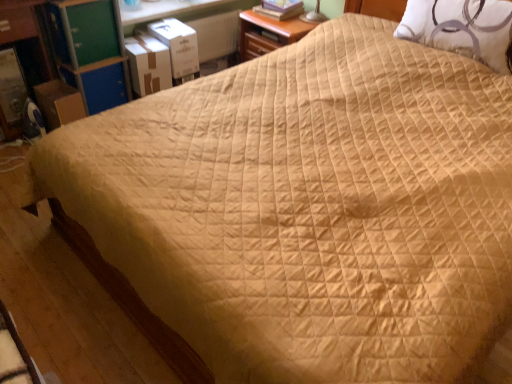
Question: Considering the relative positions of white cardboard box at upper left, which ranks as the second cardboard box in left-to-right order, and hardcover book at upper center in the image provided, is white cardboard box at upper left, which ranks as the second cardboard box in left-to-right order, to the left of hardcover book at upper center from the viewer's perspective?

Choices:
 (A) no
 (B) yes

Answer: (B)

Question: Can you confirm if white cardboard box at upper left, which ranks as the second cardboard box in left-to-right order, is bigger than hardcover book at upper center?

Choices:
 (A) yes
 (B) no

Answer: (A)

Question: Does white cardboard box at upper left, acting as the 2th cardboard box starting from the right, turn towards hardcover book at upper center?

Choices:
 (A) no
 (B) yes

Answer: (A)

Question: Can you confirm if white cardboard box at upper left, which ranks as the second cardboard box in left-to-right order, is shorter than hardcover book at upper center?

Choices:
 (A) yes
 (B) no

Answer: (B)

Question: Is hardcover book at upper center inside white cardboard box at upper left, acting as the 2th cardboard box starting from the right?

Choices:
 (A) yes
 (B) no

Answer: (B)

Question: Would you say green plastic dresser at upper left, placed as the second dresser when sorted from left to right, is to the left or to the right of brown cardboard box at left, the third cardboard box when ordered from right to left, in the picture?

Choices:
 (A) left
 (B) right

Answer: (B)

Question: Is point coord(7,39) positioned closer to the camera than point coord(50,112)?

Choices:
 (A) closer
 (B) farther

Answer: (A)

Question: From a real-world perspective, is green plastic dresser at upper left, placed as the second dresser when sorted from left to right, above or below brown cardboard box at left, marked as the 1th cardboard box in a left-to-right arrangement?

Choices:
 (A) above
 (B) below

Answer: (A)

Question: Is green plastic dresser at upper left, which is the first dresser in right-to-left order, bigger or smaller than brown cardboard box at left, the third cardboard box when ordered from right to left?

Choices:
 (A) small
 (B) big

Answer: (B)

Question: In terms of height, does white cardboard box at upper left, which appears as the third cardboard box when viewed from the left, look taller or shorter compared to green plastic dresser at upper left, placed as the second dresser when sorted from left to right?

Choices:
 (A) short
 (B) tall

Answer: (A)

Question: From the image's perspective, is white cardboard box at upper left, which appears as the third cardboard box when viewed from the left, positioned above or below green plastic dresser at upper left, placed as the second dresser when sorted from left to right?

Choices:
 (A) above
 (B) below

Answer: (A)

Question: Is white cardboard box at upper left, which appears as the third cardboard box when viewed from the left, bigger or smaller than green plastic dresser at upper left, which is the first dresser in right-to-left order?

Choices:
 (A) big
 (B) small

Answer: (B)

Question: Considering the positions of white cardboard box at upper left, the first cardboard box in the right-to-left sequence, and green plastic dresser at upper left, placed as the second dresser when sorted from left to right, in the image, is white cardboard box at upper left, the first cardboard box in the right-to-left sequence, wider or thinner than green plastic dresser at upper left, placed as the second dresser when sorted from left to right,?

Choices:
 (A) wide
 (B) thin

Answer: (B)

Question: Looking at their shapes, would you say white cardboard box at upper left, which ranks as the second cardboard box in left-to-right order, is wider or thinner than brown cardboard box at left, the third cardboard box when ordered from right to left?

Choices:
 (A) thin
 (B) wide

Answer: (B)

Question: From the image's perspective, is white cardboard box at upper left, which ranks as the second cardboard box in left-to-right order, located above or below brown cardboard box at left, the third cardboard box when ordered from right to left?

Choices:
 (A) below
 (B) above

Answer: (B)